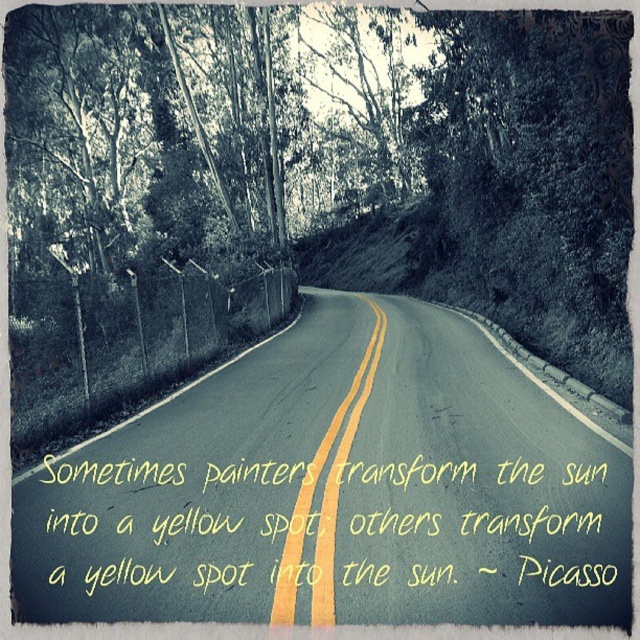
Question: Does yellow asphalt road at center lie behind yellow painted lines at center?

Choices:
 (A) yes
 (B) no

Answer: (A)

Question: Among these objects, which one is farthest from the camera?

Choices:
 (A) yellow asphalt road at center
 (B) yellow painted lines at center

Answer: (A)

Question: Does yellow asphalt road at center appear under yellow painted lines at center?

Choices:
 (A) no
 (B) yes

Answer: (B)

Question: Which object appears farthest from the camera in this image?

Choices:
 (A) yellow asphalt road at center
 (B) yellow painted lines at center

Answer: (A)

Question: Is yellow asphalt road at center smaller than yellow painted lines at center?

Choices:
 (A) yes
 (B) no

Answer: (B)